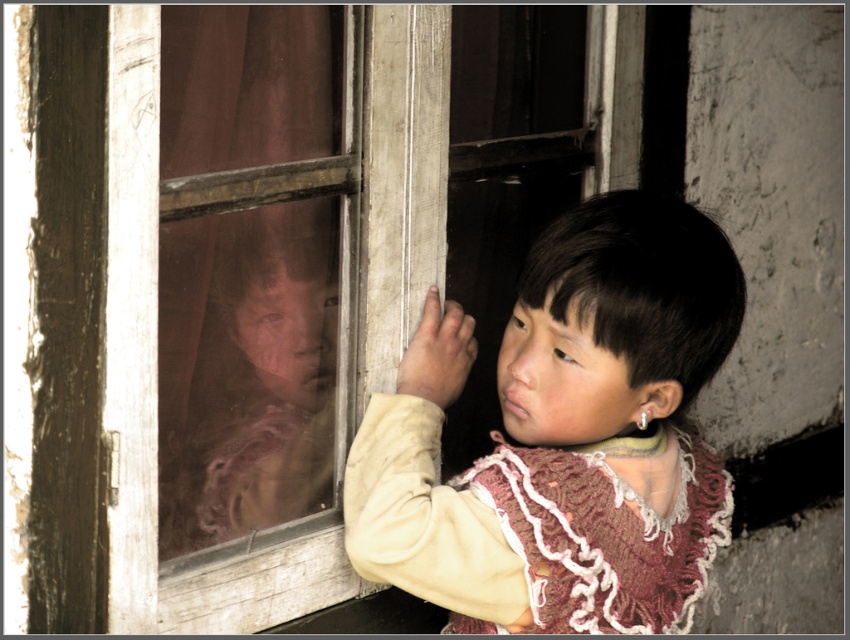
Is wooden frame at center thinner than light beige sweater at center?

Indeed, wooden frame at center has a lesser width compared to light beige sweater at center.

Can you confirm if wooden frame at center is shorter than light beige sweater at center?

Incorrect, wooden frame at center's height does not fall short of light beige sweater at center's.

The height and width of the screenshot is (640, 850). What are the coordinates of `wooden frame at center` in the screenshot? It's located at (110, 353).

Does point (412, 134) lie behind point (299, 390)?

That is False.

Is the position of wooden frame at center less distant than that of brown fabric curtain at left?

Yes, wooden frame at center is in front of brown fabric curtain at left.

Image resolution: width=850 pixels, height=640 pixels. What do you see at coordinates (110, 353) in the screenshot?
I see `wooden frame at center` at bounding box center [110, 353].

I want to click on wooden frame at center, so click(x=110, y=353).

Is light beige sweater at center shorter than brown fabric curtain at left?

Yes.

I want to click on light beige sweater at center, so click(x=570, y=440).